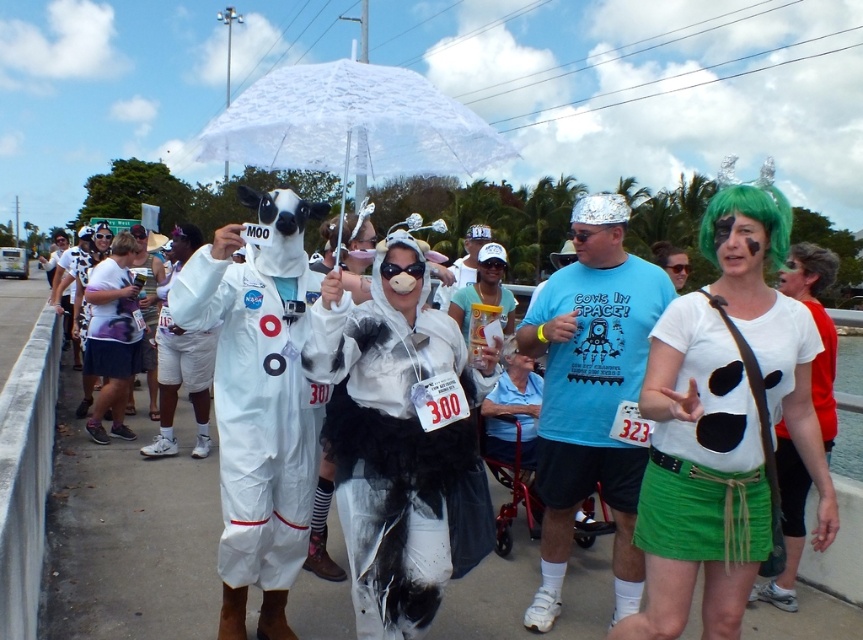
You are a photographer at the event and need to capture a photo that includes both the white lace umbrella at center and the green synthetic wig at upper right. Given that your camera has a maximum focus range of 6 meters, will you be able to include both in the same frame without moving the camera?

The distance between the white lace umbrella at center and the green synthetic wig at upper right is 7.00 meters, which exceeds the camera maximum focus range of 6 meters. Therefore, you cannot include both in the same frame without moving the camera.

You are a photographer at the event and want to capture both the white matte cow costume at center and the white fluffy costume at center in a single photo. Which costume should you position closer to the left side of the camera frame to ensure both are visible?

You should position the white matte cow costume at center closer to the left side of the camera frame since it is already to the left of the white fluffy costume at center in the scene.